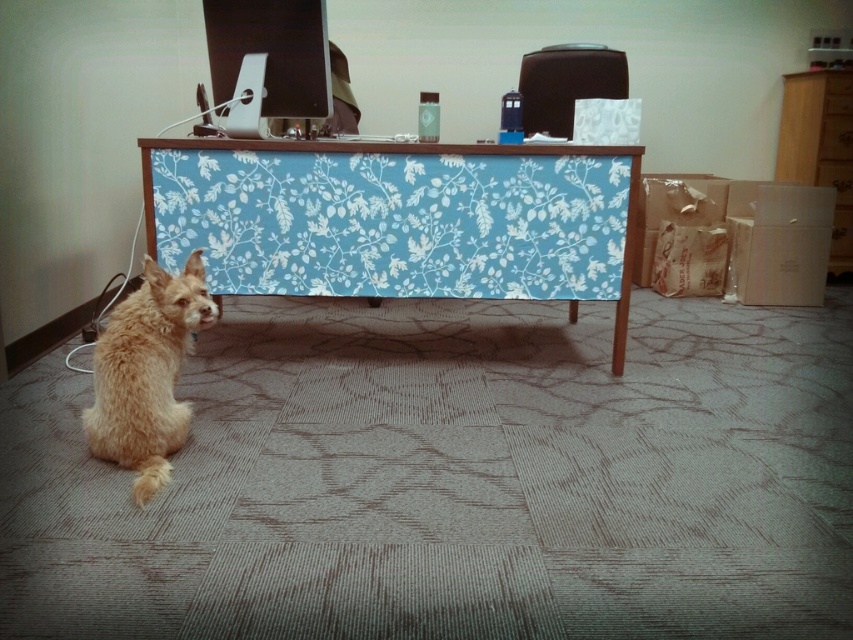
Does metallic silver monitor at upper center lie in front of matte black speaker at upper center?

Yes, it is.

What do you see at coordinates (271, 51) in the screenshot? I see `metallic silver monitor at upper center` at bounding box center [271, 51].

Identify the location of metallic silver monitor at upper center. This screenshot has height=640, width=853. (271, 51).

Who is shorter, blue fabric-covered desk at center or matte black speaker at upper center?

Standing shorter between the two is matte black speaker at upper center.

Who is positioned more to the left, blue fabric-covered desk at center or matte black speaker at upper center?

blue fabric-covered desk at center is more to the left.

Who is more forward, (339, 221) or (524, 100)?

Point (339, 221) is in front.

The width and height of the screenshot is (853, 640). Find the location of `blue fabric-covered desk at center`. blue fabric-covered desk at center is located at coordinates (397, 220).

Between fuzzy golden dog at lower left and brown wood dresser at upper right, which one appears on the left side from the viewer's perspective?

From the viewer's perspective, fuzzy golden dog at lower left appears more on the left side.

Who is shorter, fuzzy golden dog at lower left or brown wood dresser at upper right?

Standing shorter between the two is fuzzy golden dog at lower left.

Is point (144, 413) behind point (814, 160)?

No, (144, 413) is closer to viewer.

Locate an element on the screen. This screenshot has height=640, width=853. fuzzy golden dog at lower left is located at coordinates (146, 372).